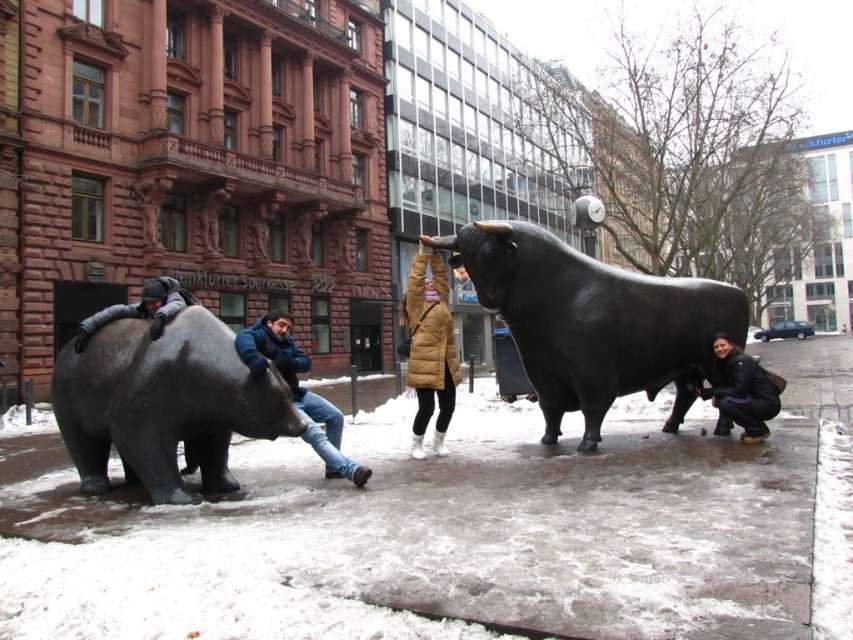
Question: Considering the real-world distances, which object is farthest from the black matte jacket at lower right?

Choices:
 (A) polished bronze bear at left
 (B) shiny black bull at center
 (C) blue denim jeans at center

Answer: (A)

Question: Which object is positioned closest to the polished bronze bear at left?

Choices:
 (A) black matte jacket at lower right
 (B) brown puffer jacket at center
 (C) dark gray metallic bear at left

Answer: (C)

Question: Does polished bronze bear at left have a larger size compared to dark gray metallic bear at left?

Choices:
 (A) no
 (B) yes

Answer: (A)

Question: Which object is positioned closest to the blue denim jeans at center?

Choices:
 (A) shiny black bull at center
 (B) dark gray metallic bear at left
 (C) brown puffer jacket at center
 (D) polished bronze bear at left

Answer: (D)

Question: Does polished bronze bear at left come in front of black matte jacket at lower right?

Choices:
 (A) no
 (B) yes

Answer: (B)

Question: Does polished bronze bear at left have a greater width compared to black matte jacket at lower right?

Choices:
 (A) no
 (B) yes

Answer: (B)